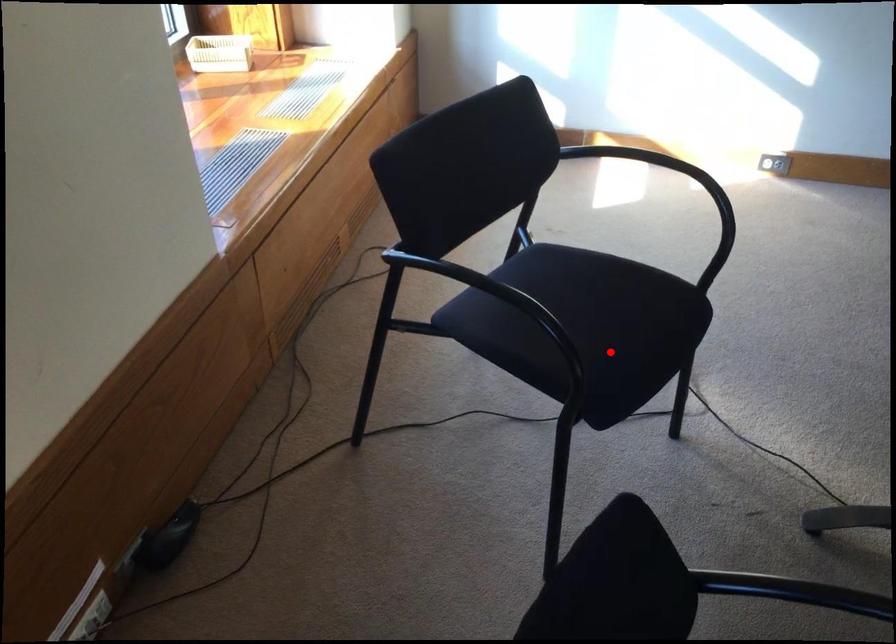
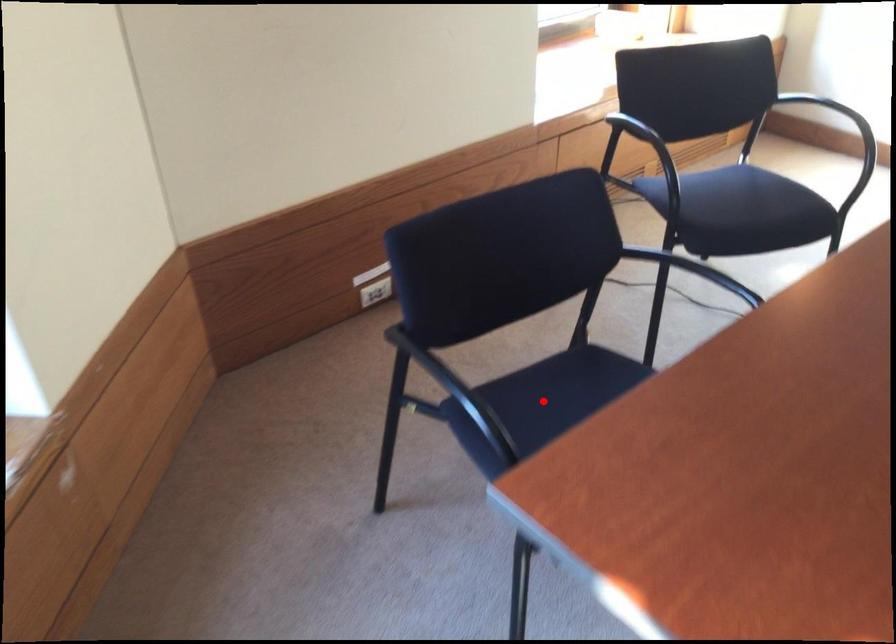
I am providing you with two images of the same scene from different viewpoints. A red point is marked on the first image and another point is marked on the second image. Does the point marked in image1 correspond to the same location as the one in image2?

No